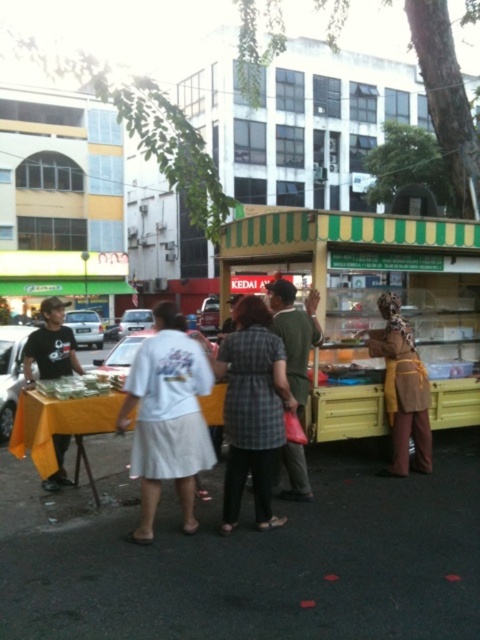
You are standing at the food stall with the green and yellow striped awning and want to reach both the point at coordinates point (376, 390) and the point at coordinates point (266, 452). Which point is closer to you?

Point (266, 452) is closer to you because it is less further to the viewer than point (376, 390).